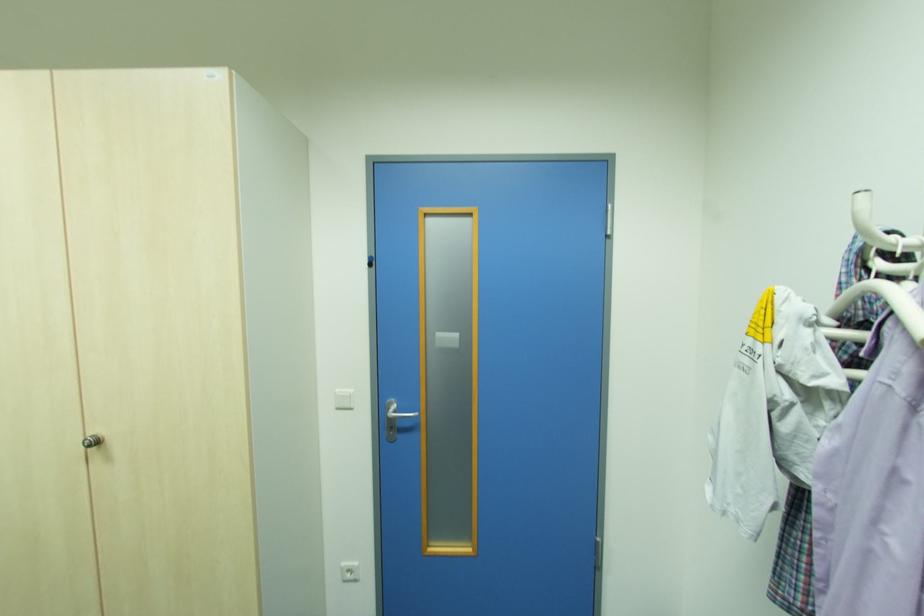
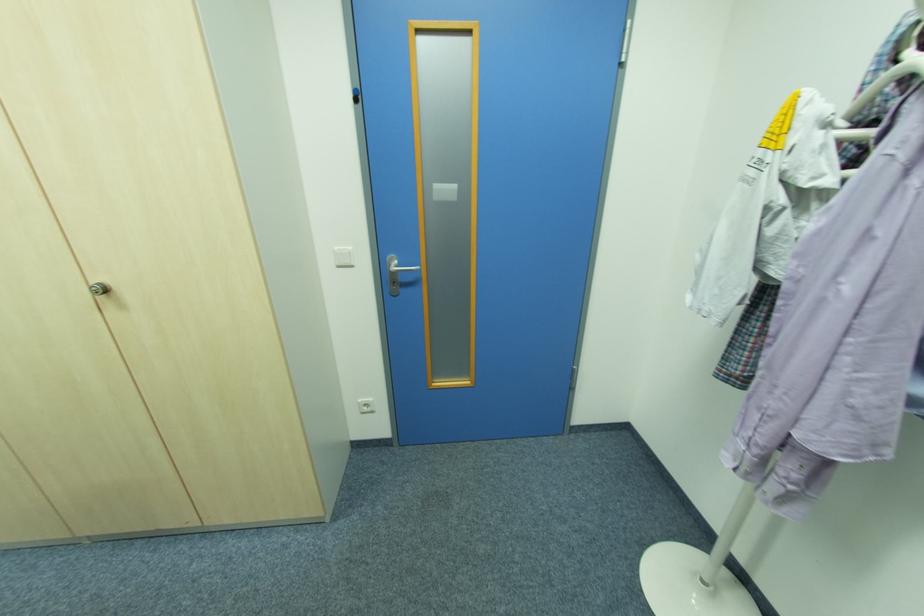
Locate, in the second image, the point that corresponds to point 103,444 in the first image.

(108, 292)